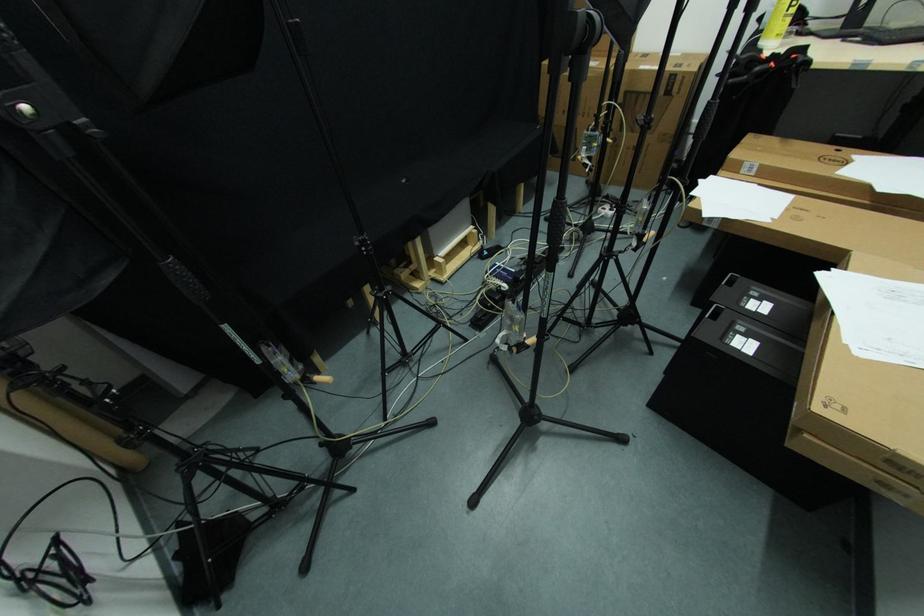
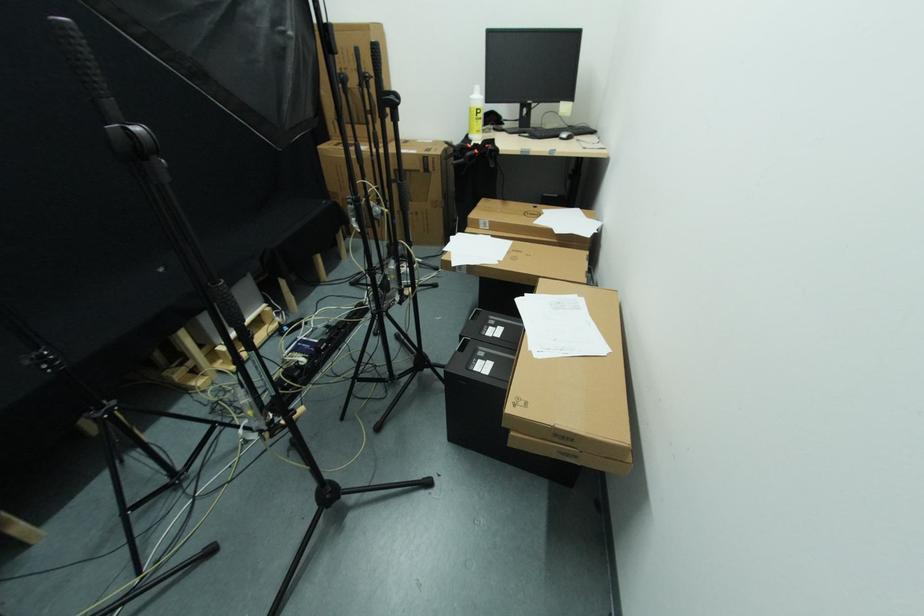
Find the pixel in the second image that matches pixel 438 275 in the first image.

(225, 365)